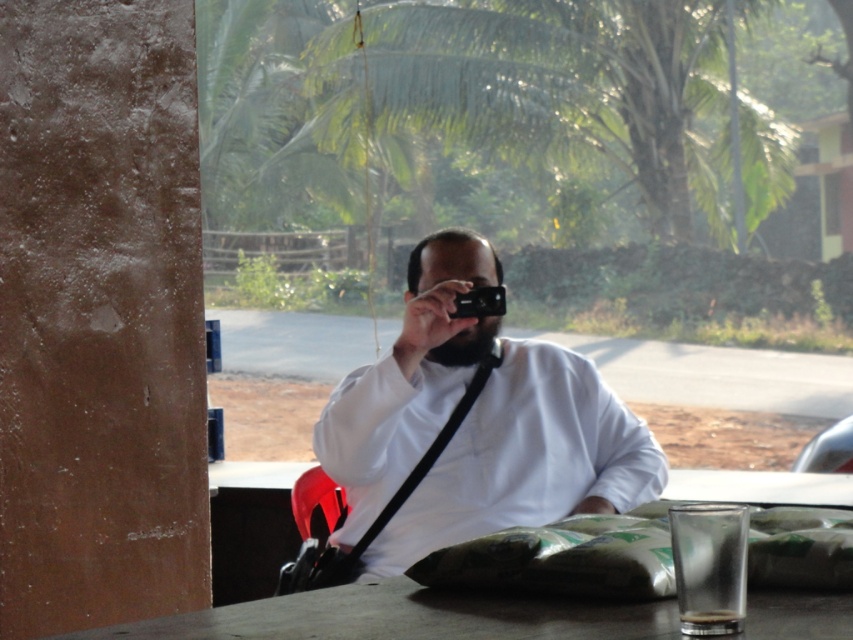
You are a photographer who wants to ensure their camera is visible in the photo they are taking. Given that the white matte shirt at center and the black plastic camera at center are both in the frame, which object should be moved to avoid blocking the camera?

The white matte shirt at center is larger in size than the black plastic camera at center, so moving the white matte shirt at center would help avoid blocking the camera.

Based on the photo, you are the photographer in the scene. You notice two points marked on your camera screen. One is at coordinate point (358, 483) and the other at point (473, 296). Based on your current position and the scene layout, which point is closer to you?

Point (358, 483) is in front of point (473, 296), so the point at (358, 483) is closer to you.

You are a photographer observing the scene and need to adjust your equipment. Which object, the white matte shirt at center or the black plastic camera at center, is positioned higher relative to the other?

The white matte shirt at center is taller than the black plastic camera at center, so the white matte shirt at center is positioned higher.